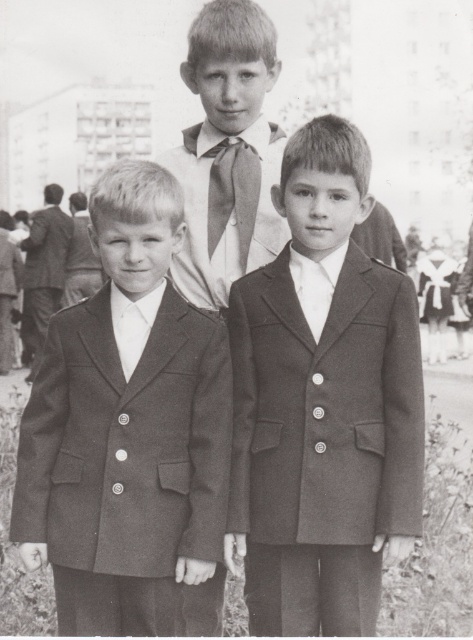
Question: Can you confirm if matte black suit at center is positioned to the right of smooth white shirt at center?

Choices:
 (A) no
 (B) yes

Answer: (B)

Question: Which point is closer to the camera?

Choices:
 (A) smooth fabric suit at left
 (B) matte white dress at center
 (C) smooth white shirt at center

Answer: (C)

Question: Does matte black suit at center have a greater width compared to matte white dress at center?

Choices:
 (A) no
 (B) yes

Answer: (A)

Question: Which of these objects is positioned farthest from the silky light gray tie at center?

Choices:
 (A) smooth fabric suit at center
 (B) matte white dress at center
 (C) matte black suit at center

Answer: (B)

Question: In this image, where is matte black suit at center located relative to smooth fabric suit at left?

Choices:
 (A) left
 (B) right

Answer: (B)

Question: Considering the real-world distances, which object is closest to the matte white dress at center?

Choices:
 (A) smooth fabric suit at center
 (B) smooth fabric suit at left

Answer: (B)